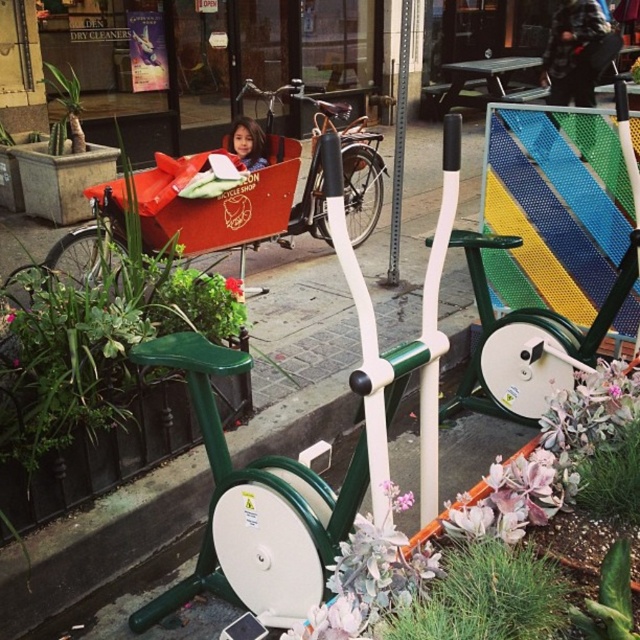
Question: Among these points, which one is farthest from the camera?

Choices:
 (A) (396, 166)
 (B) (84, 234)

Answer: (A)

Question: Can you confirm if matte orange cargo bike at center is thinner than metallic pole at center?

Choices:
 (A) no
 (B) yes

Answer: (A)

Question: Is metallic pole at center wider than green leafy plant at left?

Choices:
 (A) no
 (B) yes

Answer: (A)

Question: Which object appears farthest from the camera in this image?

Choices:
 (A) metallic pole at center
 (B) matte red cargo bike at center
 (C) matte orange cargo bike at center
 (D) smooth skin face at center

Answer: (B)

Question: Can you confirm if metallic pole at center is positioned above green leafy plant at left?

Choices:
 (A) no
 (B) yes

Answer: (A)

Question: Among these objects, which one is nearest to the camera?

Choices:
 (A) smooth skin face at center
 (B) matte red cargo bike at center
 (C) metallic pole at center

Answer: (C)